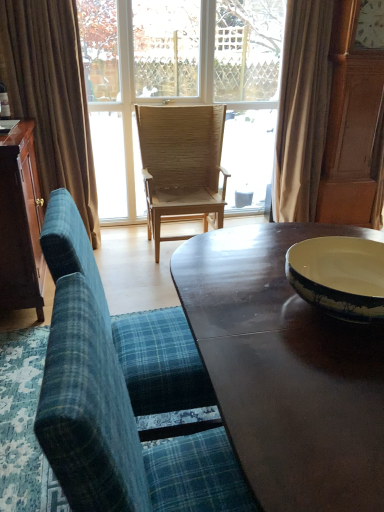
Question: Is dark brown wood cabinet at left inside the boundaries of clear glass window at center, or outside?

Choices:
 (A) inside
 (B) outside

Answer: (B)

Question: Is dark brown wood cabinet at left in front of or behind clear glass window at center in the image?

Choices:
 (A) front
 (B) behind

Answer: (A)

Question: Estimate the real-world distances between objects in this image. Which object is closer to the wooden chair at center, which is the 2th chair from front to back?

Choices:
 (A) blue plaid fabric chair at lower left, the 1th chair positioned from the front
 (B) dark brown wood cabinet at left
 (C) clear glass window at center
 (D) wooden woven chair at center, the third chair viewed from the front
 (E) shiny dark wood coffee table at center

Answer: (E)

Question: Which of these objects is positioned farthest from the dark brown wood cabinet at left?

Choices:
 (A) wooden woven chair at center, which is counted as the 1th chair, starting from the back
 (B) clear glass window at center
 (C) blue plaid fabric chair at lower left, which is the 3th chair in back-to-front order
 (D) wooden chair at center, which is the 2th chair from front to back
 (E) beige fabric curtain at upper right, the second curtain viewed from the left

Answer: (E)